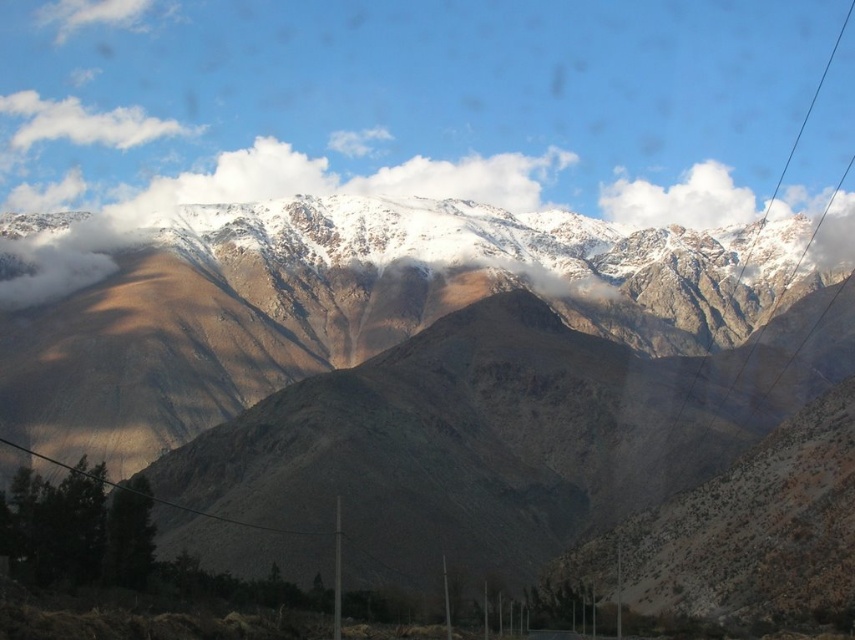
Question: Is brown rocky mountain range at upper center below white fluffy cloud at upper left?

Choices:
 (A) yes
 (B) no

Answer: (A)

Question: Is the position of brown rocky mountain range at upper center more distant than that of white fluffy cloud at upper left?

Choices:
 (A) no
 (B) yes

Answer: (A)

Question: Among these objects, which one is farthest from the camera?

Choices:
 (A) brown rocky mountain range at upper center
 (B) white fluffy cloud at upper left

Answer: (B)

Question: Which is farther from the brown rocky mountain range at upper center?

Choices:
 (A) white fluffy cloud at upper left
 (B) white fluffy cloud at upper center

Answer: (A)

Question: Is brown rocky mountain range at upper center closer to the viewer compared to white fluffy cloud at upper left?

Choices:
 (A) yes
 (B) no

Answer: (A)

Question: Which object is positioned farthest from the brown rocky mountain range at upper center?

Choices:
 (A) white fluffy cloud at upper center
 (B) white fluffy cloud at upper left

Answer: (B)